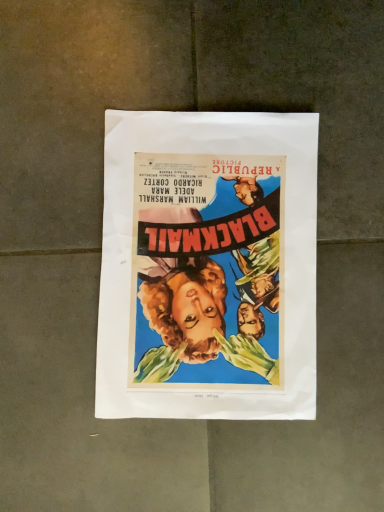
Identify the location of empty space that is ontop of vibrant paper poster at center (from a real-world perspective). (200, 250).